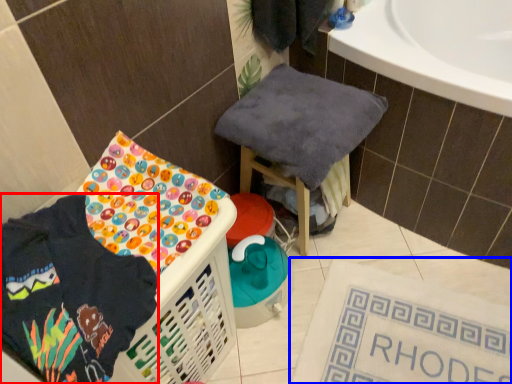
Question: Among these objects, which one is farthest to the camera, clothing (highlighted by a red box) or bath mat (highlighted by a blue box)?

Choices:
 (A) clothing
 (B) bath mat

Answer: (B)